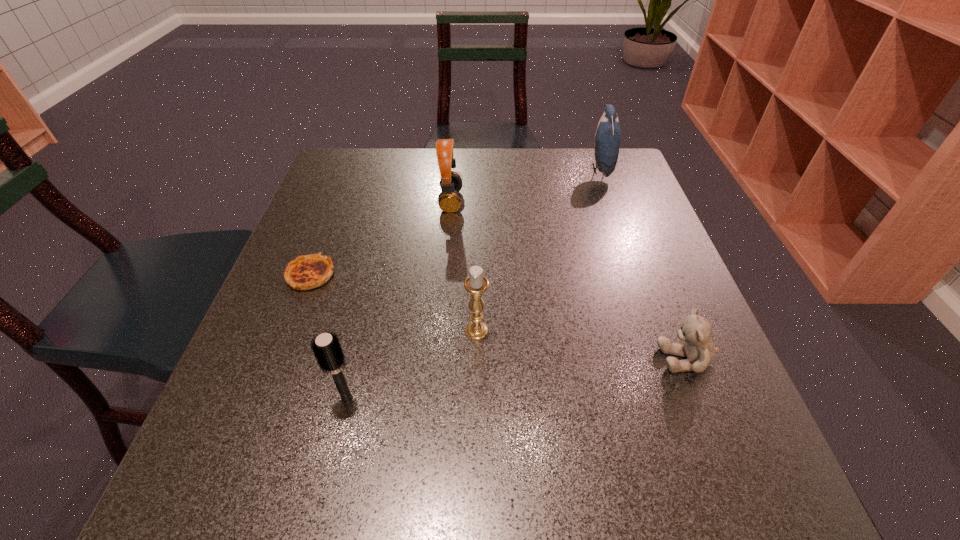
In order to click on headset that is at the far edge in this screenshot , I will do `click(449, 200)`.

At what (x,y) coordinates should I click in order to perform the action: click on object at the left edge. Please return your answer as a coordinate pair (x, y). The height and width of the screenshot is (540, 960). Looking at the image, I should click on (311, 271).

Find the location of a particular element. The image size is (960, 540). bird that is at the right edge is located at coordinates pos(608,134).

I want to click on teddy bear that is at the right edge, so click(699, 349).

Image resolution: width=960 pixels, height=540 pixels. I want to click on object located at the far right corner, so click(x=608, y=134).

At what (x,y) coordinates should I click in order to perform the action: click on vacant space at the far edge of the desktop. Please return your answer as a coordinate pair (x, y). Looking at the image, I should click on (513, 172).

At what (x,y) coordinates should I click in order to perform the action: click on free space at the near edge of the desktop. Please return your answer as a coordinate pair (x, y). This screenshot has width=960, height=540. Looking at the image, I should click on (468, 457).

In the image, there is a desktop. Where is `vacant region at the left edge`? The width and height of the screenshot is (960, 540). vacant region at the left edge is located at coordinates (290, 346).

In order to click on free region at the right edge of the desktop in this screenshot , I will do `click(662, 231)`.

Find the location of a particular element. The image size is (960, 540). vacant space at the near left corner is located at coordinates (219, 516).